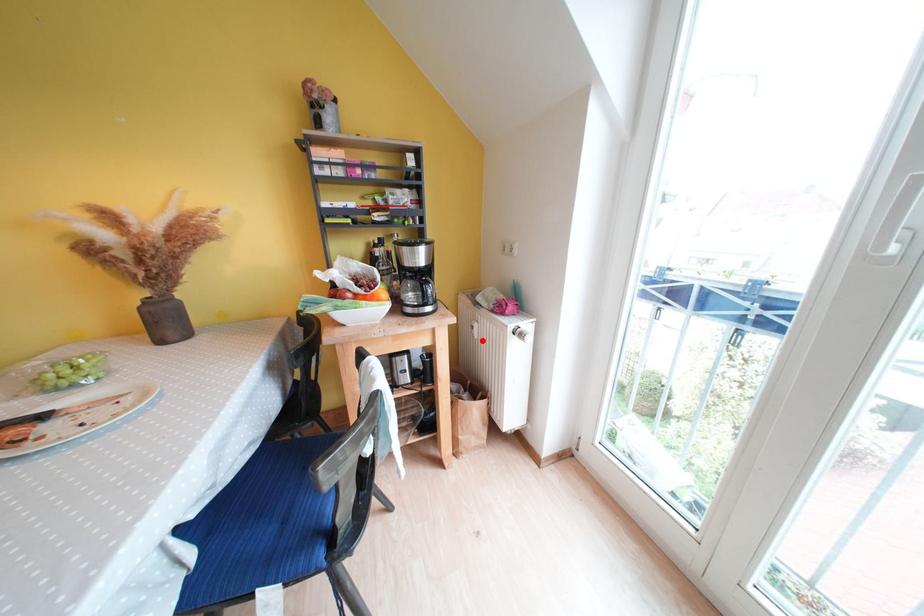
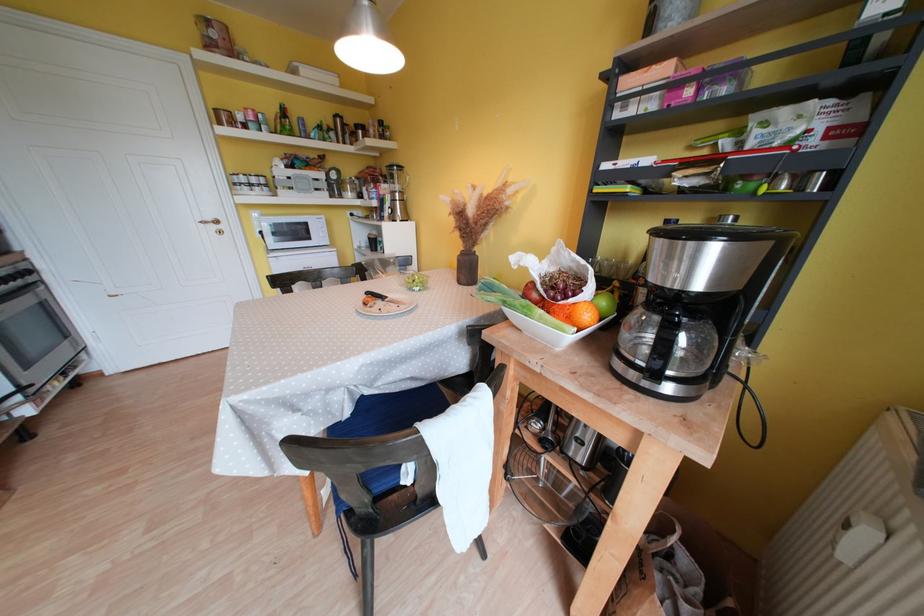
Question: I am providing you with two images of the same scene from different viewpoints. In image1, a red point is highlighted. Considering the same 3D point in image2, which of the following is correct?

Choices:
 (A) It is closer
 (B) It is farther

Answer: (B)